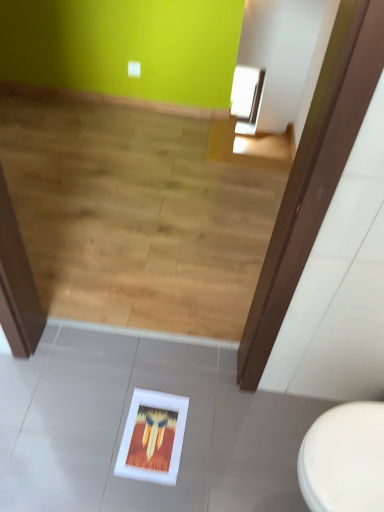
You are a GUI agent. You are given a task and a screenshot of the screen. Output one action in this format:
    pyautogui.click(x=<x>, y=<y>)
    Task: Click on the vacant area located to the right-hand side of white matte picture frame at lower center
    Image resolution: width=384 pixels, height=512 pixels.
    Given the screenshot: What is the action you would take?
    pyautogui.click(x=205, y=445)